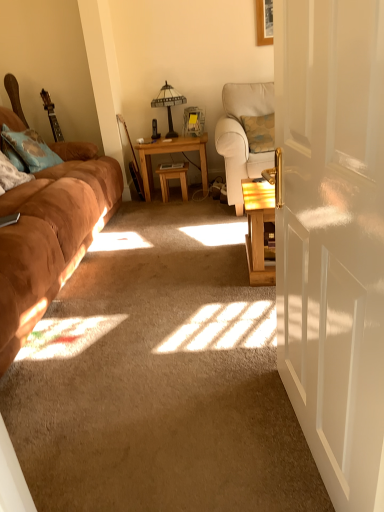
Question: From a real-world perspective, is blue textured pillow at left positioned over white glossy door at center right based on gravity?

Choices:
 (A) yes
 (B) no

Answer: (B)

Question: Considering the relative sizes of blue textured pillow at left and white glossy door at center right in the image provided, is blue textured pillow at left bigger than white glossy door at center right?

Choices:
 (A) no
 (B) yes

Answer: (B)

Question: Does blue textured pillow at left lie behind white glossy door at center right?

Choices:
 (A) yes
 (B) no

Answer: (A)

Question: Does blue textured pillow at left have a greater height compared to white glossy door at center right?

Choices:
 (A) yes
 (B) no

Answer: (B)

Question: Is blue textured pillow at left oriented away from white glossy door at center right?

Choices:
 (A) no
 (B) yes

Answer: (A)

Question: Can white glossy door at center right be found inside blue textured pillow at left?

Choices:
 (A) no
 (B) yes

Answer: (A)

Question: Can you confirm if matte glass table lamp at center is smaller than white glossy door at center right?

Choices:
 (A) yes
 (B) no

Answer: (A)

Question: Is matte glass table lamp at center bigger than white glossy door at center right?

Choices:
 (A) no
 (B) yes

Answer: (A)

Question: From the image's perspective, is matte glass table lamp at center on white glossy door at center right?

Choices:
 (A) no
 (B) yes

Answer: (B)

Question: Can you confirm if matte glass table lamp at center is taller than white glossy door at center right?

Choices:
 (A) yes
 (B) no

Answer: (B)

Question: Can you confirm if matte glass table lamp at center is wider than white glossy door at center right?

Choices:
 (A) yes
 (B) no

Answer: (A)

Question: Are matte glass table lamp at center and white glossy door at center right far apart?

Choices:
 (A) no
 (B) yes

Answer: (B)

Question: Does matte plastic picture frame at center have a lesser width compared to wooden table at center, acting as the 1th table starting from the right?

Choices:
 (A) yes
 (B) no

Answer: (A)